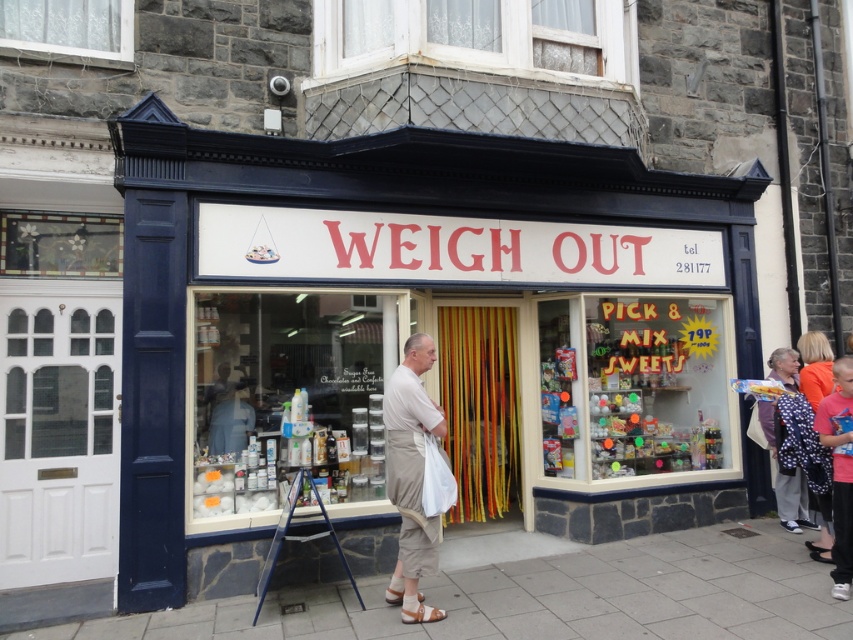
Question: Is pink fabric at lower right wider than brown leather sandal at lower center?

Choices:
 (A) yes
 (B) no

Answer: (A)

Question: Can you confirm if pink fabric at lower right is bigger than polka dot dress at right?

Choices:
 (A) no
 (B) yes

Answer: (A)

Question: Among these points, which one is nearest to the camera?

Choices:
 (A) (428, 188)
 (B) (840, 413)
 (C) (386, 408)

Answer: (C)

Question: Which object is closer to the camera taking this photo?

Choices:
 (A) white painted wood storefront at center
 (B) polka dot dress at right
 (C) tan leather sandal at lower center
 (D) pink fabric at lower right

Answer: (C)

Question: Among these objects, which one is nearest to the camera?

Choices:
 (A) polka dot dress at right
 (B) brown leather sandal at lower center
 (C) gray concrete pavement at lower center
 (D) pink fabric at lower right

Answer: (C)

Question: Considering the relative positions of white painted wood storefront at center and polka dot dress at right in the image provided, where is white painted wood storefront at center located with respect to polka dot dress at right?

Choices:
 (A) right
 (B) left

Answer: (B)